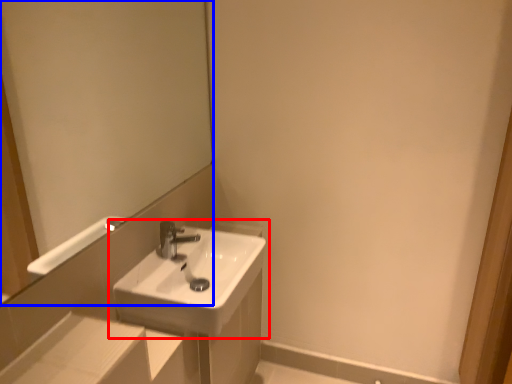
Question: Which of the following is the farthest to the observer, sink (highlighted by a red box) or mirror (highlighted by a blue box)?

Choices:
 (A) sink
 (B) mirror

Answer: (A)